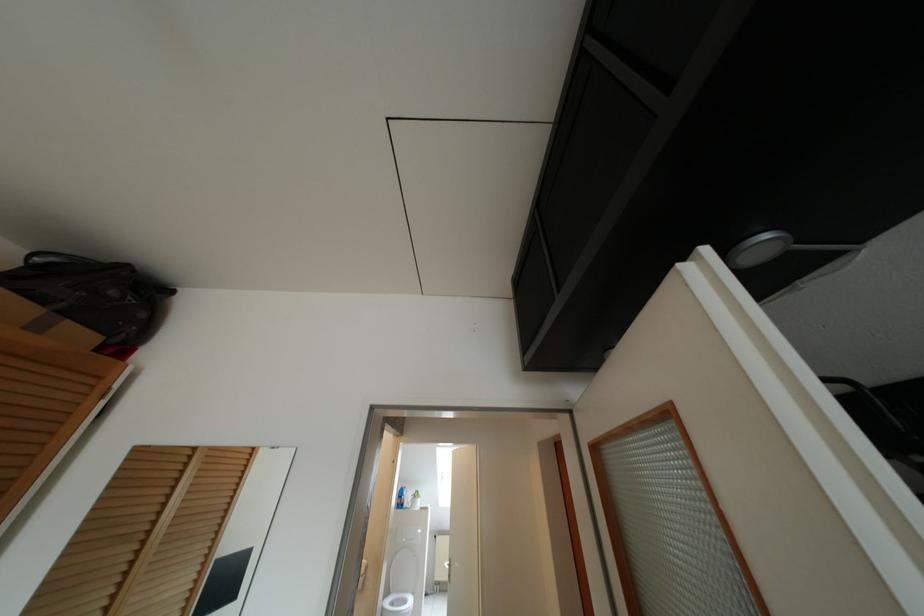
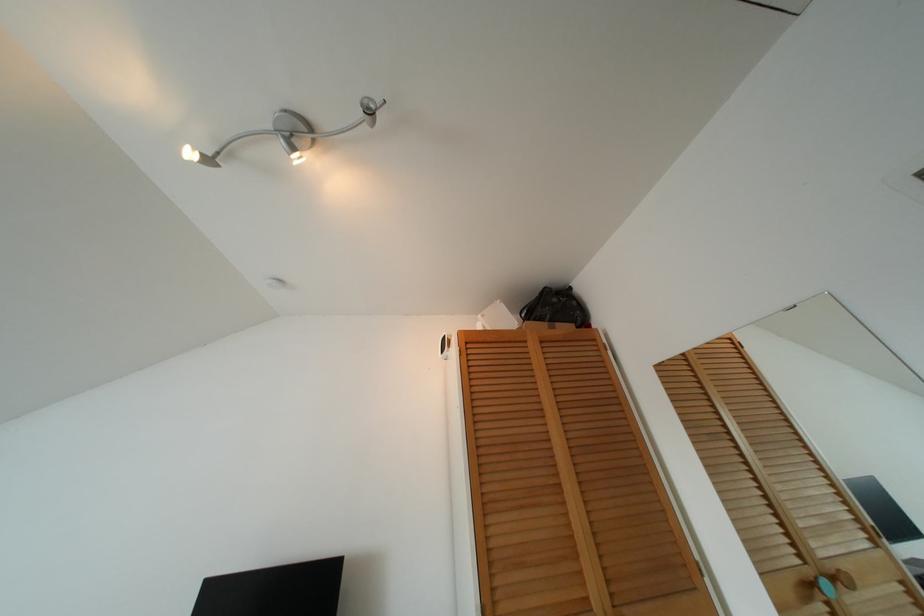
Locate, in the second image, the point that corresponds to point 40,299 in the first image.

(541, 318)